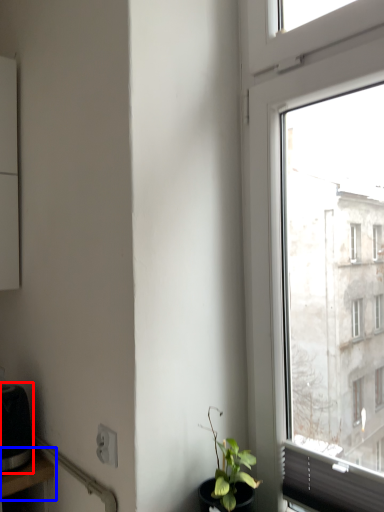
Question: Which object is further to the camera taking this photo, appliance (highlighted by a red box) or table (highlighted by a blue box)?

Choices:
 (A) appliance
 (B) table

Answer: (A)